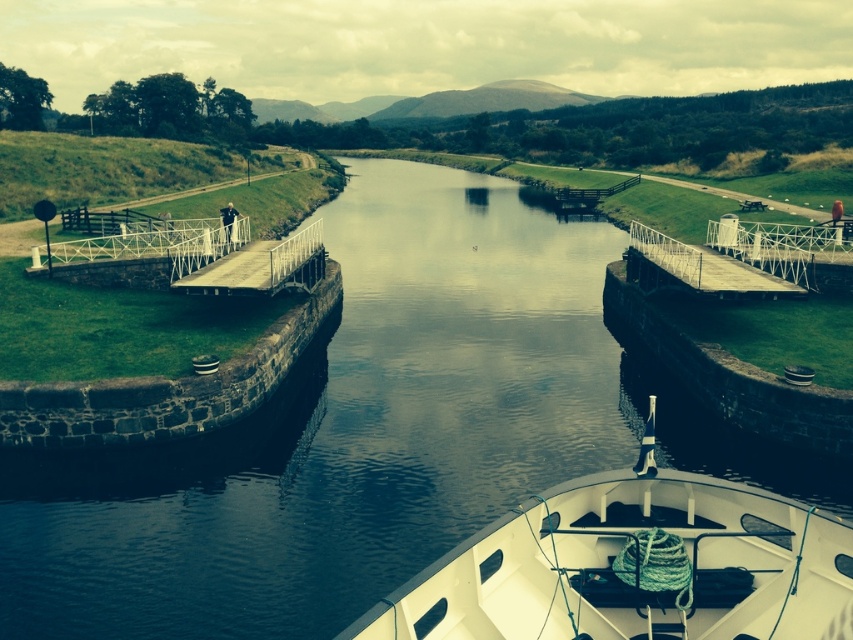
Who is more distant from viewer, (486, 605) or (280, 264)?

Point (280, 264)

Where is `white matte boat at center`? The image size is (853, 640). white matte boat at center is located at coordinates (634, 564).

Between point (770, 253) and point (279, 246), which one is positioned behind?

The point (770, 253) is behind.

Which is behind, point (726, 291) or point (207, 262)?

Positioned behind is point (207, 262).

Identify the location of white metal dock at center. The height and width of the screenshot is (640, 853). (712, 266).

Can you confirm if white matte boat at center is taller than white metal dock at center?

Incorrect, white matte boat at center's height is not larger of white metal dock at center's.

This screenshot has height=640, width=853. I want to click on white matte boat at center, so click(634, 564).